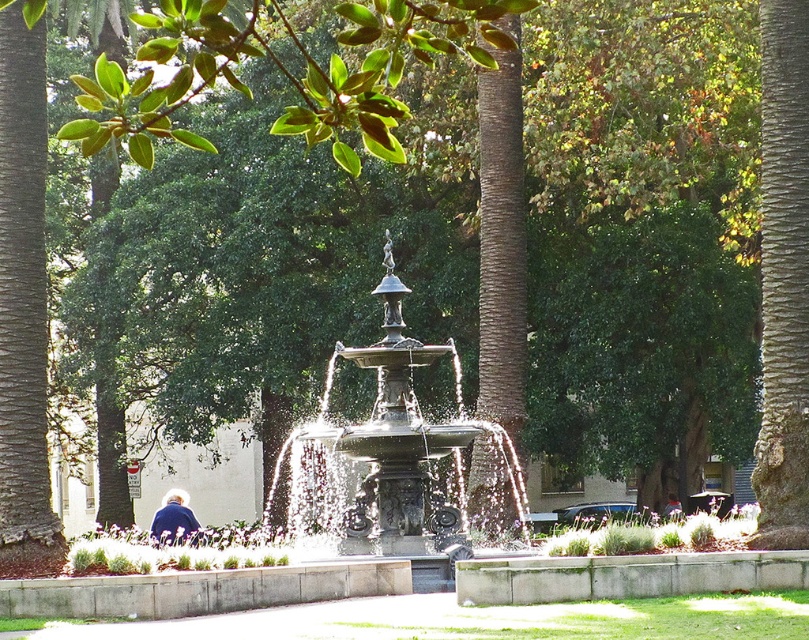
Between point (197, 522) and point (666, 512), which one is positioned in front?

Positioned in front is point (197, 522).

Does point (172, 515) come in front of point (676, 502)?

Yes.

You are a GUI agent. You are given a task and a screenshot of the screen. Output one action in this format:
    pyautogui.click(x=<x>, y=<y>)
    Task: Click on the blue fabric jacket at lower left
    
    Given the screenshot: What is the action you would take?
    pyautogui.click(x=174, y=518)

Is point (799, 515) positioned in front of point (162, 525)?

Yes, it is in front of point (162, 525).

Does brown rough bark tree at right have a greater width compared to blue fabric jacket at lower left?

No.

Where is `brown rough bark tree at right`? The height and width of the screenshot is (640, 809). brown rough bark tree at right is located at coordinates (782, 278).

Is point (780, 250) behind point (345, 433)?

No, (780, 250) is in front of (345, 433).

Based on the photo, is brown rough bark tree at right below polished bronze fountain at center?

No.

Locate an element on the screen. Image resolution: width=809 pixels, height=640 pixels. brown rough bark tree at right is located at coordinates (782, 278).